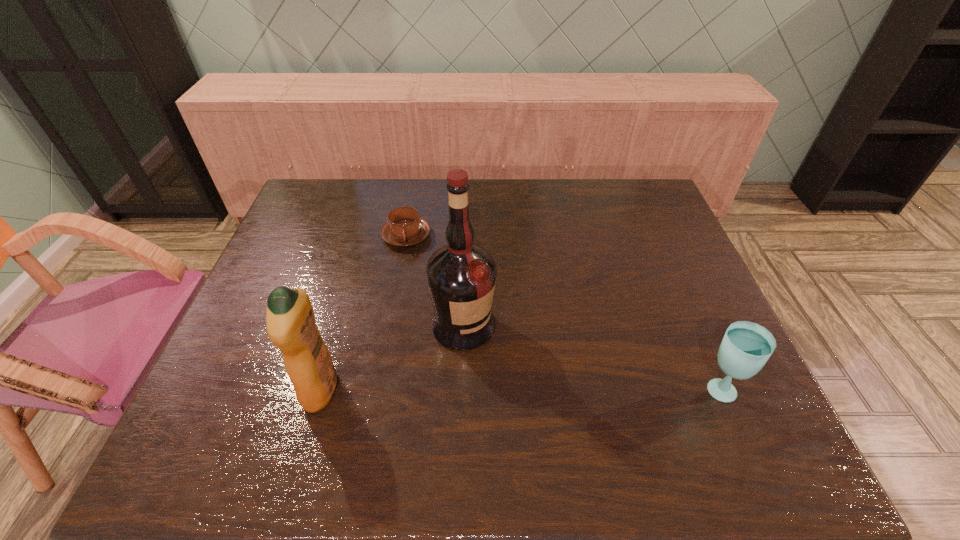
At what (x,y) coordinates should I click in order to perform the action: click on vacant space that is in between the cappuccino and the third shortest object. Please return your answer as a coordinate pair (x, y). The image size is (960, 540). Looking at the image, I should click on (364, 313).

Locate an element on the screen. This screenshot has height=540, width=960. free space between the third object from right to left and the rightmost object is located at coordinates (562, 312).

You are a GUI agent. You are given a task and a screenshot of the screen. Output one action in this format:
    pyautogui.click(x=<x>, y=<y>)
    Task: Click on the vacant space in between the glass and the third object from left to right
    The height and width of the screenshot is (540, 960).
    Given the screenshot: What is the action you would take?
    [590, 357]

The image size is (960, 540). I want to click on free spot between the third shortest object and the cappuccino, so click(364, 313).

Where is `free space between the third object from left to right and the second shortest object`? This screenshot has width=960, height=540. free space between the third object from left to right and the second shortest object is located at coordinates (590, 357).

I want to click on the closest object to the glass, so click(461, 276).

Where is `object that is the closest one to the detergent`? object that is the closest one to the detergent is located at coordinates (461, 276).

You are a GUI agent. You are given a task and a screenshot of the screen. Output one action in this format:
    pyautogui.click(x=<x>, y=<y>)
    Task: Click on the vacant region that satisfies the following two spatial constraints: 1. on the front side of the second object from right to left; 2. on the right side of the rightmost object
    
    Given the screenshot: What is the action you would take?
    pyautogui.click(x=461, y=389)

At what (x,y) coordinates should I click in order to perform the action: click on vacant space that satisfies the following two spatial constraints: 1. on the front side of the glass; 2. on the right side of the farthest object. Please return your answer as a coordinate pair (x, y). Looking at the image, I should click on (378, 389).